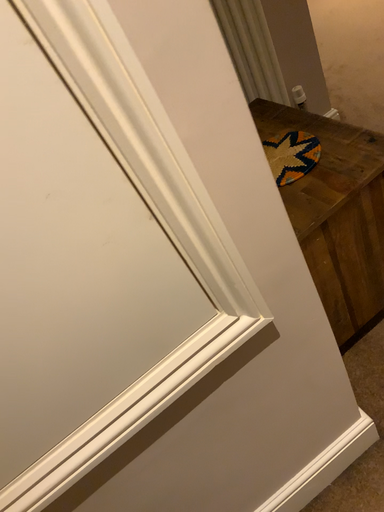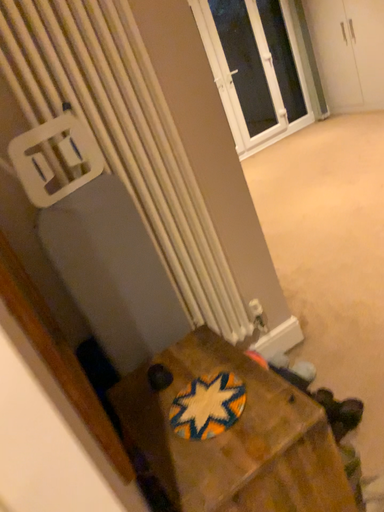
Question: How did the camera likely rotate when shooting the video?

Choices:
 (A) rotated downward
 (B) rotated upward

Answer: (B)